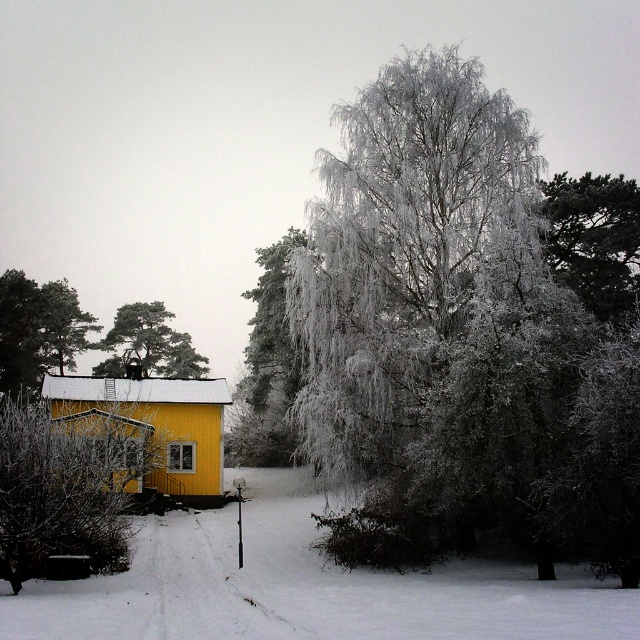
You are a hiker who wants to take a photo of the dark green textured pine tree at upper right and the smooth brown tree trunk at left. Which tree should you stand closer to in order to capture both in the same frame?

You should stand closer to the dark green textured pine tree at upper right because it is shorter than the smooth brown tree trunk at left, allowing both to fit within the camera frame when positioned nearer to the shorter tree.